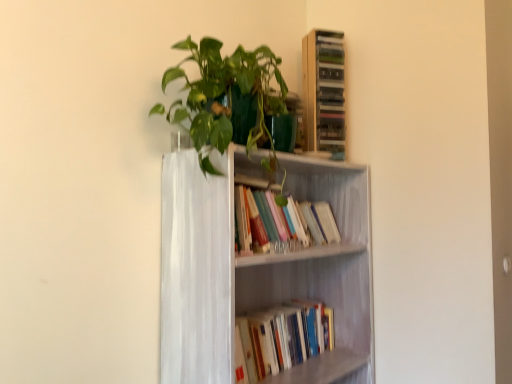
Question: From the image's perspective, is wooden cabinet at upper right located above or below white painted wood bookcase at center?

Choices:
 (A) below
 (B) above

Answer: (B)

Question: Would you say wooden cabinet at upper right is to the left or to the right of white painted wood bookcase at center in the picture?

Choices:
 (A) right
 (B) left

Answer: (A)

Question: Which of these objects is positioned farthest from the white painted wood bookcase at center?

Choices:
 (A) hardcover books at center, the first book in the bottom-to-top sequence
 (B) hardcover books at center, the first book positioned from the top
 (C) wooden cabinet at upper right
 (D) green glossy plant at upper center

Answer: (C)

Question: Which is nearer to the green glossy plant at upper center?

Choices:
 (A) wooden cabinet at upper right
 (B) hardcover books at center, the second book when ordered from top to bottom
 (C) hardcover books at center, the first book positioned from the top
 (D) white painted wood bookcase at center

Answer: (D)